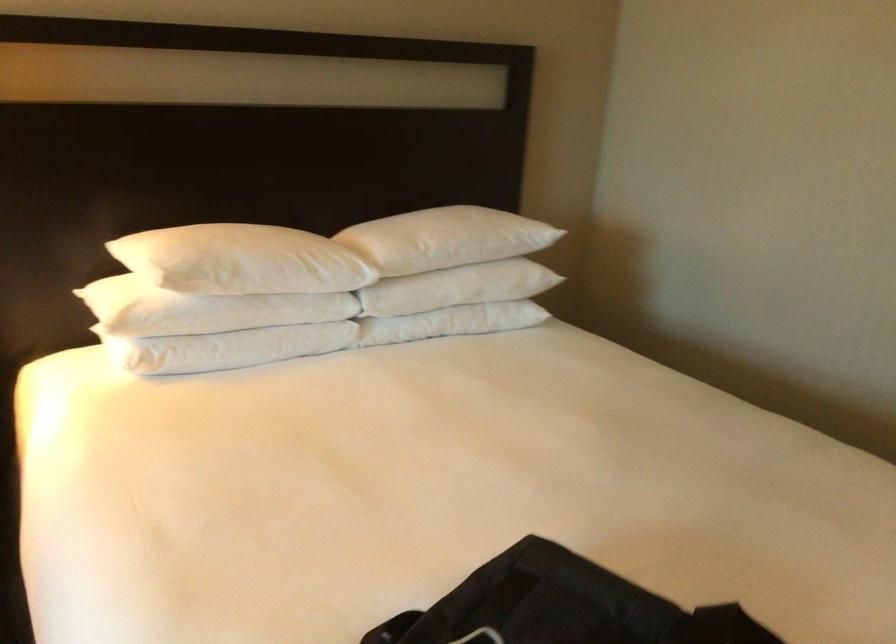
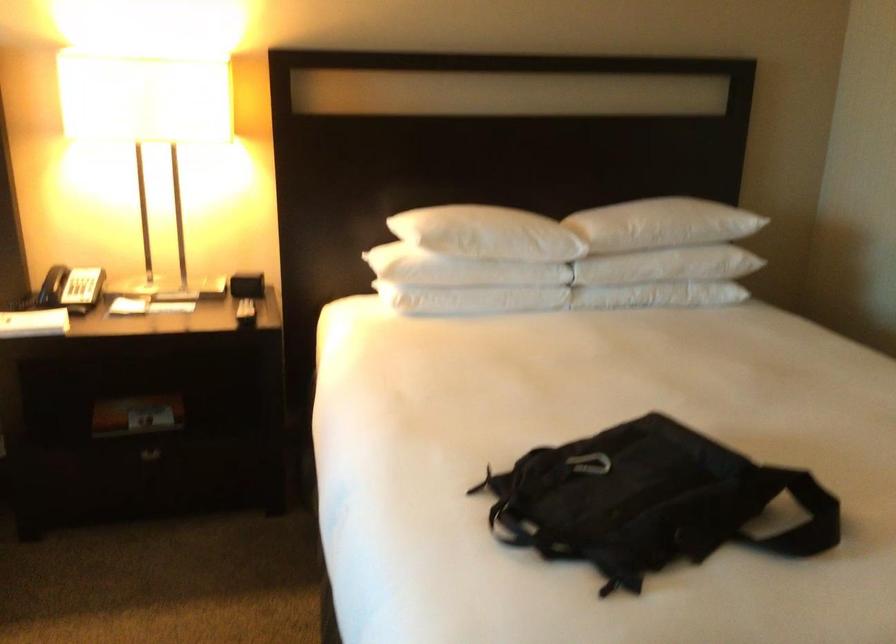
Locate, in the second image, the point that corresponds to (x=220, y=314) in the first image.

(460, 270)